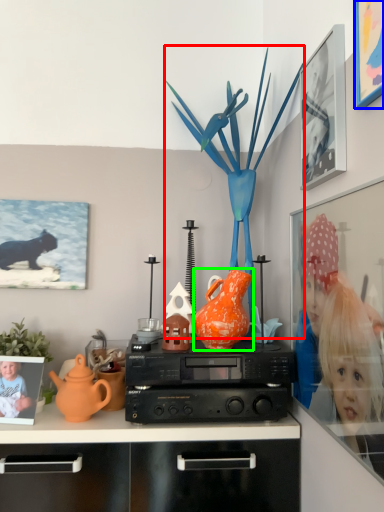
Question: Considering the real-world distances, which object is closest to toy (highlighted by a red box)? picture frame (highlighted by a blue box) or vase (highlighted by a green box).

Choices:
 (A) picture frame
 (B) vase

Answer: (B)